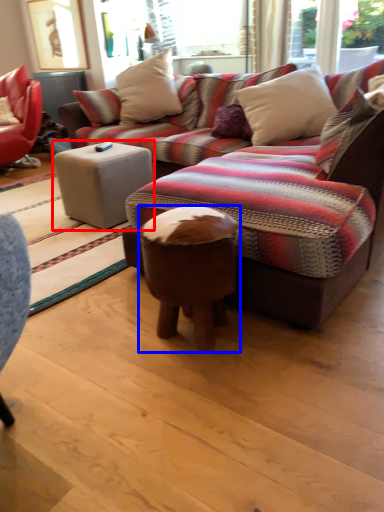
Question: Among these objects, which one is farthest to the camera, table (highlighted by a red box) or bar stool (highlighted by a blue box)?

Choices:
 (A) table
 (B) bar stool

Answer: (A)